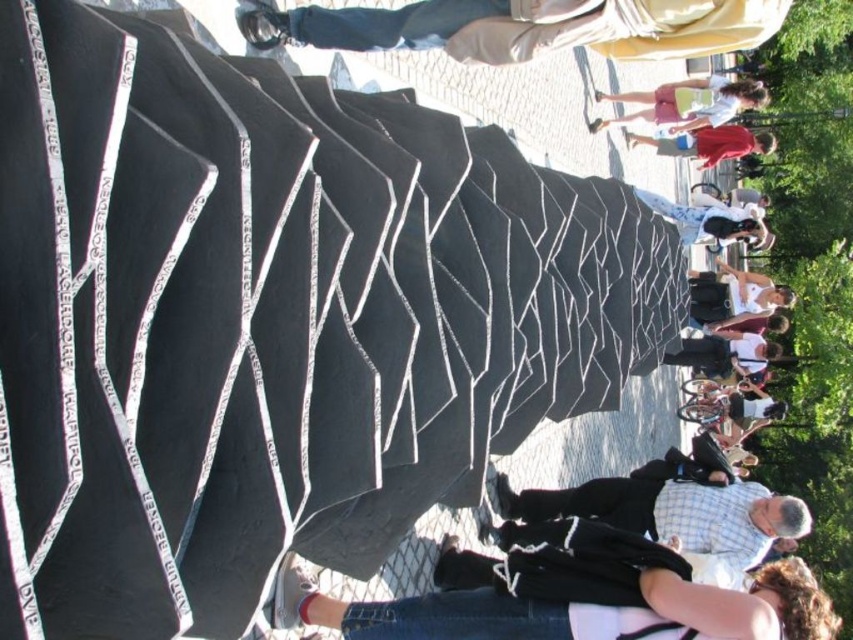
You are a photographer trying to capture a clear shot of the checkered shirt at center. However, the light beige fabric at upper center is blocking your view. Can you adjust your position to avoid the obstruction?

The light beige fabric at upper center is positioned over the checkered shirt at center, so moving your camera position lower or to the side should allow you to capture the checkered shirt at center without obstruction.

You are standing in front of the sculpture and want to take a photo of both the checkered shirt at center and the light pink shorts at upper right. Which direction should you move to ensure both are in the frame?

You should move to the left so that both the checkered shirt at center and the light pink shorts at upper right can be captured in the frame since the checkered shirt at center is to the left of the light pink shorts at upper right.